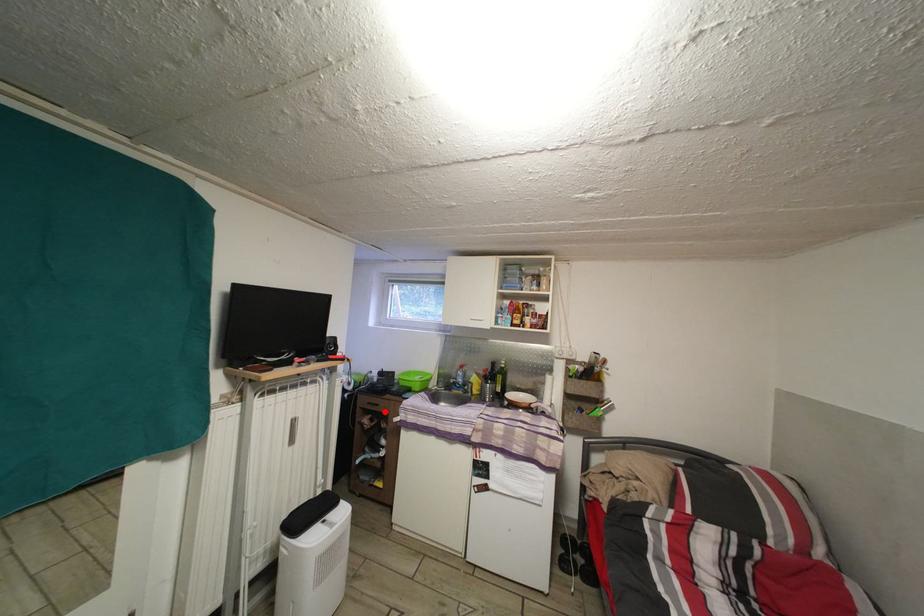
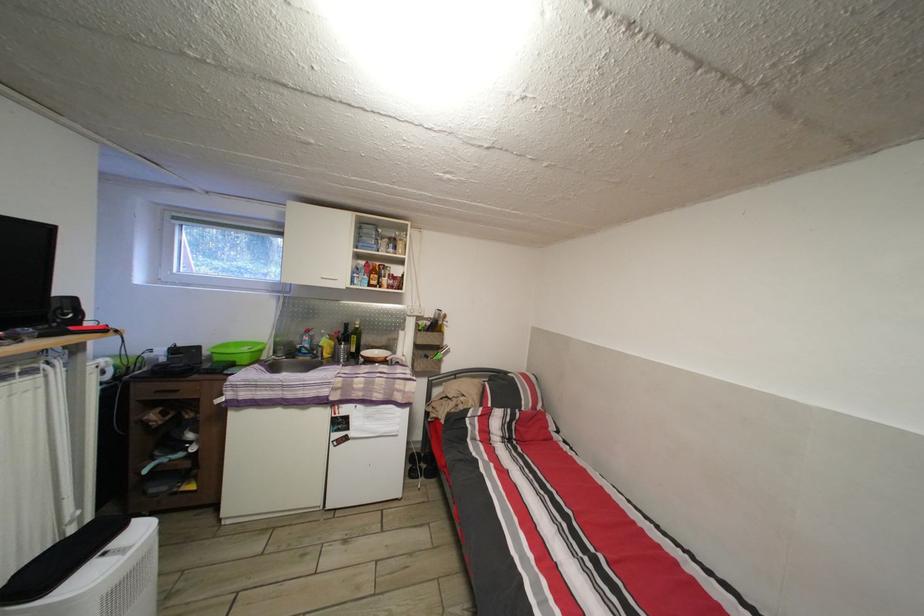
The point at the highlighted location is marked in the first image. Where is the corresponding point in the second image?

(184, 398)